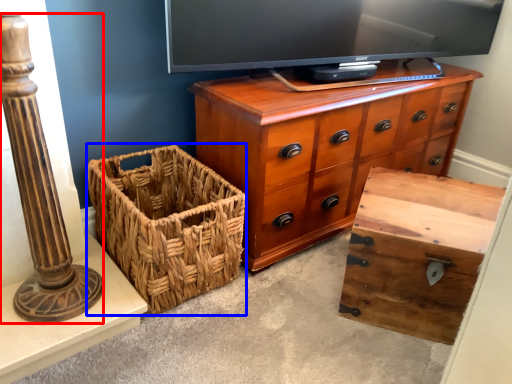
Question: Which of the following is the closest to the observer, pillar (highlighted by a red box) or basket (highlighted by a blue box)?

Choices:
 (A) pillar
 (B) basket

Answer: (A)